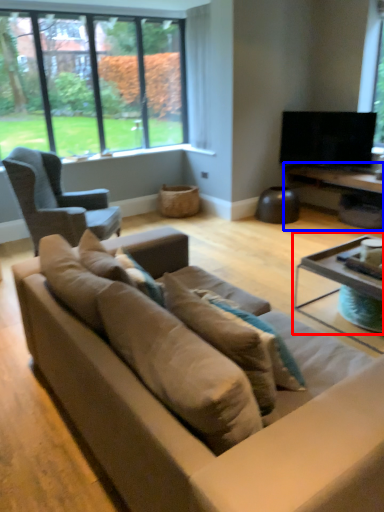
Question: Which object appears farthest to the camera in this image, coffee table (highlighted by a red box) or table (highlighted by a blue box)?

Choices:
 (A) coffee table
 (B) table

Answer: (B)